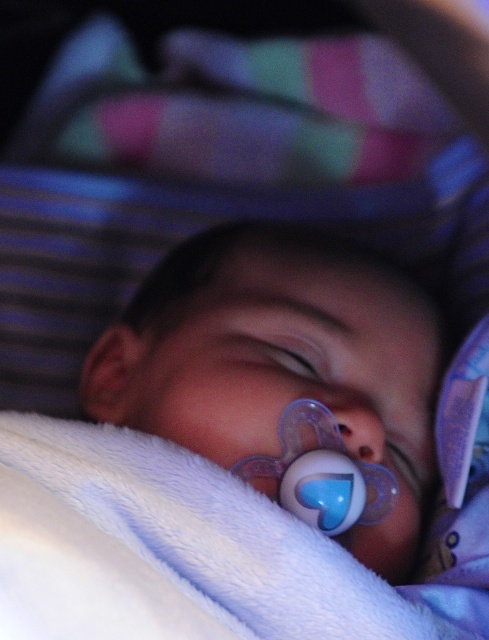
You are a parent holding a baby and want to gently remove the translucent plastic pacifier at center from the baby without waking them. Considering the distance between you and the pacifier, what is the minimum length of your fingers should be to reach it?

The minimum length of your fingers should be at least 61.37 centimeters to reach the translucent plastic pacifier at center, as the distance between them is 61.37 centimeters.

You are holding a camera and want to take a photo of the baby. The pacifier with a translucent, heart shaped design is in the center of the frame. Where should you move the camera to focus on the point at coordinate (375, 625)?

The point at coordinate (375, 625) is 50.47 centimeters away from the camera. To focus on this point, move the camera closer to the baby until the distance is reduced to an appropriate focusing range for clear capture.

Based on the photo, you are a parent holding a baby and want to check the distance between the translucent plastic pacifier at center and your hand. If your hand is 12 inches away from the baby, is the pacifier closer to the baby or your hand?

The translucent plastic pacifier at center is 24.16 inches away from the viewer. Since your hand is only 12 inches away from the baby, the pacifier is farther away from the baby than your hand.